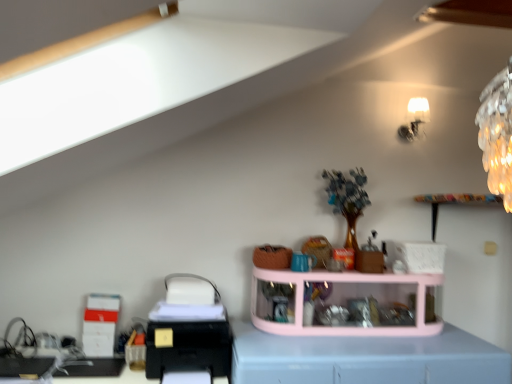
Image resolution: width=512 pixels, height=384 pixels. What are the coordinates of `white glossy lampshade at upper right` in the screenshot? It's located at (414, 119).

Where is `pink plastic shelf at center`? The image size is (512, 384). pink plastic shelf at center is located at coordinates (345, 303).

Locate an element on the screen. The width and height of the screenshot is (512, 384). light blue plastic at center is located at coordinates (366, 359).

You are a GUI agent. You are given a task and a screenshot of the screen. Output one action in this format:
    pyautogui.click(x=<x>, y=<y>)
    Task: Click on the black plastic printer at lower left
    This screenshot has width=512, height=384.
    Given the screenshot: What is the action you would take?
    (x=188, y=329)

Considering the relative sizes of pink plastic shelf at center and black plastic printer at lower left in the image provided, is pink plastic shelf at center shorter than black plastic printer at lower left?

No.

Is pink plastic shelf at center oriented away from black plastic printer at lower left?

No, pink plastic shelf at center is not facing the opposite direction of black plastic printer at lower left.

From a real-world perspective, between pink plastic shelf at center and black plastic printer at lower left, who is vertically higher?

From a 3D spatial view, pink plastic shelf at center is above.

Considering the points (410, 333) and (202, 306), which point is in front, point (410, 333) or point (202, 306)?

Point (202, 306)

Based on the photo, can you confirm if pink plastic shelf at center is shorter than white glossy lampshade at upper right?

In fact, pink plastic shelf at center may be taller than white glossy lampshade at upper right.

Who is smaller, pink plastic shelf at center or white glossy lampshade at upper right?

white glossy lampshade at upper right.

Which is more to the right, pink plastic shelf at center or white glossy lampshade at upper right?

white glossy lampshade at upper right.

Is the surface of pink plastic shelf at center in direct contact with white glossy lampshade at upper right?

No, pink plastic shelf at center is not making contact with white glossy lampshade at upper right.

Would you say white glossy lampshade at upper right is inside or outside pink plastic shelf at center?

white glossy lampshade at upper right is not inside pink plastic shelf at center, it's outside.

In the image, is white glossy lampshade at upper right positioned in front of or behind pink plastic shelf at center?

Clearly, white glossy lampshade at upper right is behind pink plastic shelf at center.

Can you confirm if white glossy lampshade at upper right is positioned to the left of pink plastic shelf at center?

Incorrect, white glossy lampshade at upper right is not on the left side of pink plastic shelf at center.

Considering the sizes of objects white glossy lampshade at upper right and pink plastic shelf at center in the image provided, who is shorter, white glossy lampshade at upper right or pink plastic shelf at center?

Standing shorter between the two is white glossy lampshade at upper right.

Considering the relative sizes of black plastic printer at lower left and pink plastic shelf at center in the image provided, is black plastic printer at lower left shorter than pink plastic shelf at center?

Yes, black plastic printer at lower left is shorter than pink plastic shelf at center.

Can you confirm if black plastic printer at lower left is bigger than pink plastic shelf at center?

Actually, black plastic printer at lower left might be smaller than pink plastic shelf at center.

From a real-world perspective, relative to pink plastic shelf at center, is black plastic printer at lower left vertically above or below?

From a real-world perspective, black plastic printer at lower left is physically below pink plastic shelf at center.

In the scene shown: Is white glossy lampshade at upper right thinner than light blue plastic at center?

Yes, white glossy lampshade at upper right is thinner than light blue plastic at center.

Considering the sizes of objects white glossy lampshade at upper right and light blue plastic at center in the image provided, who is smaller, white glossy lampshade at upper right or light blue plastic at center?

white glossy lampshade at upper right is smaller.

The width and height of the screenshot is (512, 384). Find the location of `lamp above the light blue plastic at center (from a real-world perspective)`. lamp above the light blue plastic at center (from a real-world perspective) is located at coordinates (414, 119).

Based on the photo, would you say white glossy lampshade at upper right is to the left or to the right of light blue plastic at center in the picture?

white glossy lampshade at upper right is to the right of light blue plastic at center.

Can you confirm if black plastic printer at lower left is thinner than light blue plastic at center?

Correct, the width of black plastic printer at lower left is less than that of light blue plastic at center.

Considering the sizes of objects black plastic printer at lower left and light blue plastic at center in the image provided, who is bigger, black plastic printer at lower left or light blue plastic at center?

Bigger between the two is light blue plastic at center.

Is black plastic printer at lower left positioned in front of light blue plastic at center?

No, black plastic printer at lower left is behind light blue plastic at center.

From a real-world perspective, is black plastic printer at lower left over light blue plastic at center?

Yes, from a real-world perspective, black plastic printer at lower left is over light blue plastic at center

You are a GUI agent. You are given a task and a screenshot of the screen. Output one action in this format:
    pyautogui.click(x=<x>, y=<y>)
    Task: Click on the lamp on the right side of black plastic printer at lower left
    The height and width of the screenshot is (384, 512).
    Given the screenshot: What is the action you would take?
    pyautogui.click(x=414, y=119)

Is black plastic printer at lower left positioned before white glossy lampshade at upper right?

Yes, it is.

Who is shorter, black plastic printer at lower left or white glossy lampshade at upper right?

With less height is black plastic printer at lower left.

Locate an element on the screen. printer below the pink plastic shelf at center (from the image's perspective) is located at coordinates (188, 329).

The height and width of the screenshot is (384, 512). I want to click on shelf below the white glossy lampshade at upper right (from a real-world perspective), so point(345,303).

Which object lies further to the anchor point pink plastic shelf at center, white glossy lampshade at upper right or black plastic printer at lower left?

Among the two, white glossy lampshade at upper right is located further to pink plastic shelf at center.

From the image, which object appears to be farther from black plastic printer at lower left, white glossy lampshade at upper right or pink plastic shelf at center?

Among the two, white glossy lampshade at upper right is located further to black plastic printer at lower left.

Estimate the real-world distances between objects in this image. Which object is closer to pink plastic shelf at center, black plastic printer at lower left or white glossy lampshade at upper right?

black plastic printer at lower left is closer to pink plastic shelf at center.

Based on their spatial positions, is black plastic printer at lower left or light blue plastic at center closer to white glossy lampshade at upper right?

light blue plastic at center is closer to white glossy lampshade at upper right.

Considering their positions, is pink plastic shelf at center positioned closer to light blue plastic at center than white glossy lampshade at upper right?

Among the two, pink plastic shelf at center is located nearer to light blue plastic at center.

Estimate the real-world distances between objects in this image. Which object is closer to pink plastic shelf at center, black plastic printer at lower left or light blue plastic at center?

light blue plastic at center is closer to pink plastic shelf at center.

From the picture: Estimate the real-world distances between objects in this image. Which object is further from white glossy lampshade at upper right, pink plastic shelf at center or light blue plastic at center?

light blue plastic at center.

Considering their positions, is white glossy lampshade at upper right positioned closer to light blue plastic at center than black plastic printer at lower left?

The object closer to light blue plastic at center is black plastic printer at lower left.

Locate an element on the screen. Image resolution: width=512 pixels, height=384 pixels. computer desk between black plastic printer at lower left and pink plastic shelf at center from left to right is located at coordinates (366, 359).

The height and width of the screenshot is (384, 512). What are the coordinates of `shelf situated between black plastic printer at lower left and white glossy lampshade at upper right from left to right` in the screenshot? It's located at (x=345, y=303).

You are a GUI agent. You are given a task and a screenshot of the screen. Output one action in this format:
    pyautogui.click(x=<x>, y=<y>)
    Task: Click on the shelf that lies between white glossy lampshade at upper right and light blue plastic at center from top to bottom
    
    Given the screenshot: What is the action you would take?
    pyautogui.click(x=345, y=303)

The width and height of the screenshot is (512, 384). In order to click on printer between white glossy lampshade at upper right and light blue plastic at center from top to bottom in this screenshot , I will do pyautogui.click(x=188, y=329).